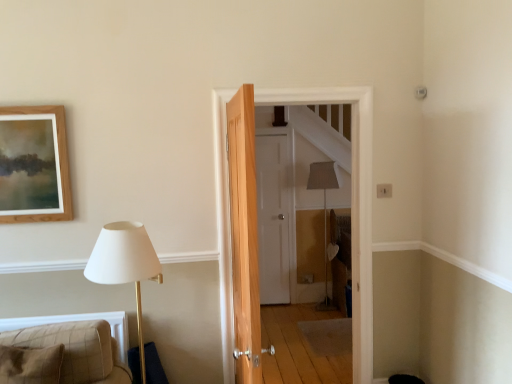
Question: Should I look upward or downward to see wooden door at center, which is the second door from back to front?

Choices:
 (A) down
 (B) up

Answer: (A)

Question: Is white matte door at center, which is the second door in front-to-back order, touching plaid fabric cushion at lower left?

Choices:
 (A) no
 (B) yes

Answer: (A)

Question: Does white matte door at center, which is the second door in front-to-back order, appear on the right side of plaid fabric cushion at lower left?

Choices:
 (A) no
 (B) yes

Answer: (B)

Question: Is white matte door at center, which appears as the 1th door when viewed from the back, looking in the opposite direction of plaid fabric cushion at lower left?

Choices:
 (A) no
 (B) yes

Answer: (A)

Question: Considering the relative sizes of white matte door at center, which is the second door in front-to-back order, and plaid fabric cushion at lower left in the image provided, is white matte door at center, which is the second door in front-to-back order, taller than plaid fabric cushion at lower left?

Choices:
 (A) no
 (B) yes

Answer: (B)

Question: Are white matte door at center, which is the second door in front-to-back order, and plaid fabric cushion at lower left located far from each other?

Choices:
 (A) no
 (B) yes

Answer: (B)

Question: Could you tell me if white matte door at center, which appears as the 1th door when viewed from the back, is turned towards plaid fabric cushion at lower left?

Choices:
 (A) yes
 (B) no

Answer: (B)

Question: Is white matte door at center, which appears as the 1th door when viewed from the back, at the right side of wooden door at center, placed as the 1th door when sorted from front to back?

Choices:
 (A) no
 (B) yes

Answer: (A)

Question: Is white matte door at center, which is the second door in front-to-back order, behind wooden door at center, which is the second door from back to front?

Choices:
 (A) yes
 (B) no

Answer: (A)

Question: From the image's perspective, is white matte door at center, which is the second door in front-to-back order, under wooden door at center, placed as the 1th door when sorted from front to back?

Choices:
 (A) yes
 (B) no

Answer: (A)

Question: Considering the relative sizes of white matte door at center, which is the second door in front-to-back order, and wooden door at center, placed as the 1th door when sorted from front to back, in the image provided, is white matte door at center, which is the second door in front-to-back order, thinner than wooden door at center, placed as the 1th door when sorted from front to back,?

Choices:
 (A) yes
 (B) no

Answer: (A)

Question: Could you tell me if white matte door at center, which appears as the 1th door when viewed from the back, is turned towards wooden door at center, placed as the 1th door when sorted from front to back?

Choices:
 (A) yes
 (B) no

Answer: (A)

Question: From a real-world perspective, does white matte door at center, which is the second door in front-to-back order, stand above wooden door at center, placed as the 1th door when sorted from front to back?

Choices:
 (A) yes
 (B) no

Answer: (B)

Question: Is the depth of wooden door at center, which is the second door from back to front, less than that of white matte door at center, which is the second door in front-to-back order?

Choices:
 (A) no
 (B) yes

Answer: (B)